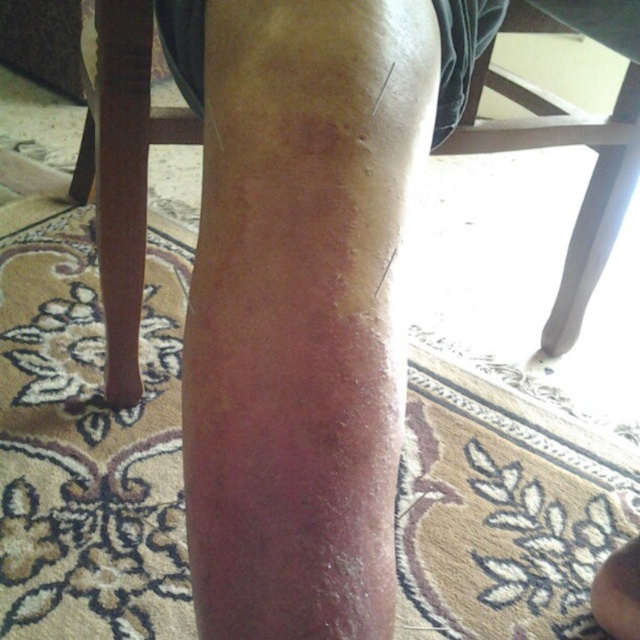
You are a dermatologist examining a patient. The patient has dry skin at center and smooth skin at lower right on their leg. You need to apply a topical cream to both areas. If the applicator reaches 20 inches, will it be sufficient to treat both areas without moving the applicator?

The dry skin at center and smooth skin at lower right are 20.75 inches apart. Since the applicator only reaches 20 inches, it is insufficient to cover the distance between both areas without moving the applicator.

You are a dermatologist examining a patient. You notice the dry skin at center and the brown wood chair at center in the image. Which object is shorter in height?

The dry skin at center is not as tall as the brown wood chair at center, so the dry skin at center is shorter in height.

You are a dermatologist examining a patient. You notice two areas on their leg shown in the image. The dry skin at center and the smooth skin at lower right. Which area is wider?

The dry skin at center is wider than the smooth skin at lower right.